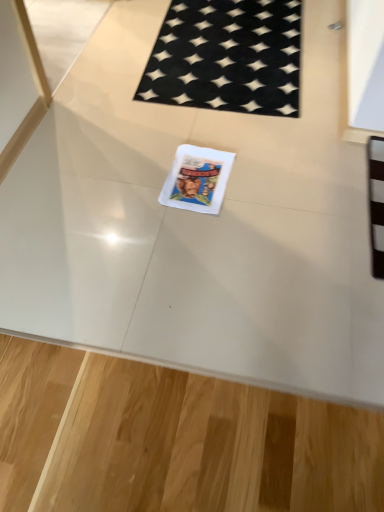
Question: Is white paper comic book at center at the left side of black woven mat at upper center?

Choices:
 (A) no
 (B) yes

Answer: (B)

Question: Can black woven mat at upper center be found inside white paper comic book at center?

Choices:
 (A) no
 (B) yes

Answer: (A)

Question: Are white paper comic book at center and black woven mat at upper center far apart?

Choices:
 (A) no
 (B) yes

Answer: (A)

Question: Is white paper comic book at center next to black woven mat at upper center?

Choices:
 (A) no
 (B) yes

Answer: (A)

Question: Is white paper comic book at center outside black woven mat at upper center?

Choices:
 (A) no
 (B) yes

Answer: (B)

Question: Is white paper comic book at center aimed at black woven mat at upper center?

Choices:
 (A) yes
 (B) no

Answer: (B)

Question: Considering the relative sizes of black woven mat at upper center and white paper comic book at center in the image provided, is black woven mat at upper center shorter than white paper comic book at center?

Choices:
 (A) no
 (B) yes

Answer: (B)

Question: Can white paper comic book at center be found inside black woven mat at upper center?

Choices:
 (A) no
 (B) yes

Answer: (A)

Question: Considering the relative sizes of black woven mat at upper center and white paper comic book at center in the image provided, is black woven mat at upper center bigger than white paper comic book at center?

Choices:
 (A) no
 (B) yes

Answer: (B)

Question: From a real-world perspective, is black woven mat at upper center on top of white paper comic book at center?

Choices:
 (A) yes
 (B) no

Answer: (B)

Question: From the image's perspective, is black woven mat at upper center on white paper comic book at center?

Choices:
 (A) yes
 (B) no

Answer: (A)

Question: Is black woven mat at upper center directly adjacent to white paper comic book at center?

Choices:
 (A) no
 (B) yes

Answer: (A)

Question: Considering the positions of black woven mat at upper center and white paper comic book at center in the image, is black woven mat at upper center taller or shorter than white paper comic book at center?

Choices:
 (A) tall
 (B) short

Answer: (B)